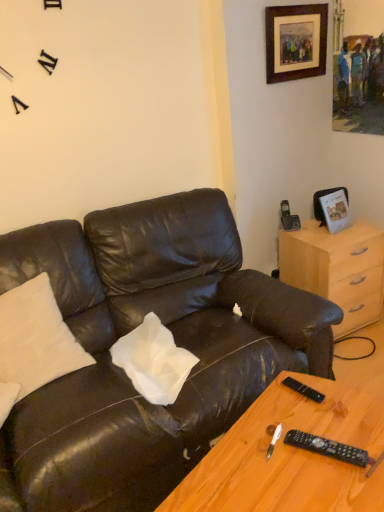
Locate an element on the screen. free space in front of black plastic remote at lower right, which is the first remote in top-to-bottom order is located at coordinates (316, 430).